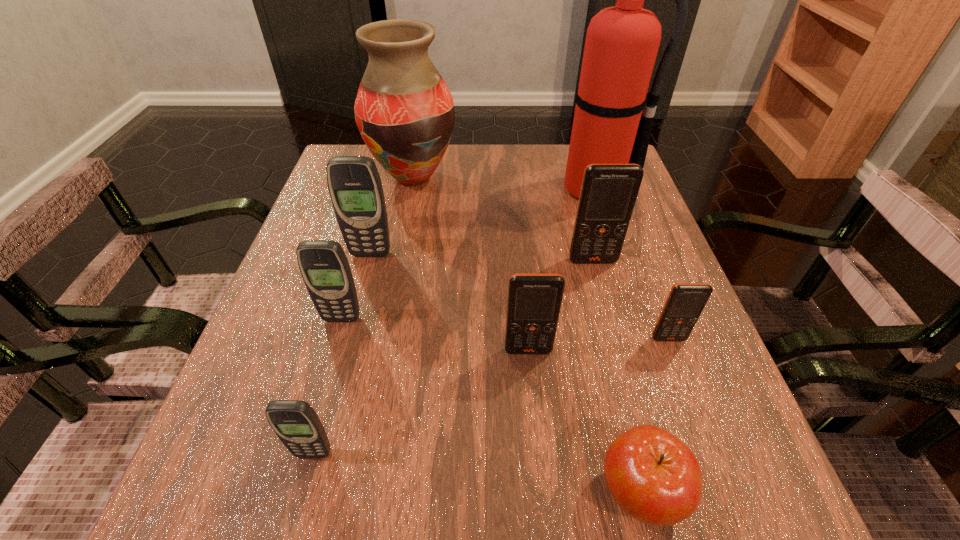
Image resolution: width=960 pixels, height=540 pixels. Identify the location of vacant space located 0.280m on the screen of the rightmost orange cellular telephone. point(736,519).

In order to click on vacant space situated 0.050m on the screen of the nearest gray cellular telephone in this screenshot , I will do `click(302, 496)`.

Identify the location of fire extinguisher that is at the far edge. (622, 42).

Identify the location of vase that is at the far edge. The image size is (960, 540). (404, 111).

The image size is (960, 540). I want to click on vase that is positioned at the left edge, so click(404, 111).

The image size is (960, 540). What are the coordinates of `fire extinguisher present at the right edge` in the screenshot? It's located at (622, 42).

Locate an element on the screen. object at the far left corner is located at coordinates (404, 111).

In order to click on object that is at the far right corner in this screenshot , I will do `click(622, 42)`.

In the image, there is a desktop. Identify the location of free space at the far edge. (468, 170).

Locate an element on the screen. The height and width of the screenshot is (540, 960). free spot at the near edge of the desktop is located at coordinates (587, 470).